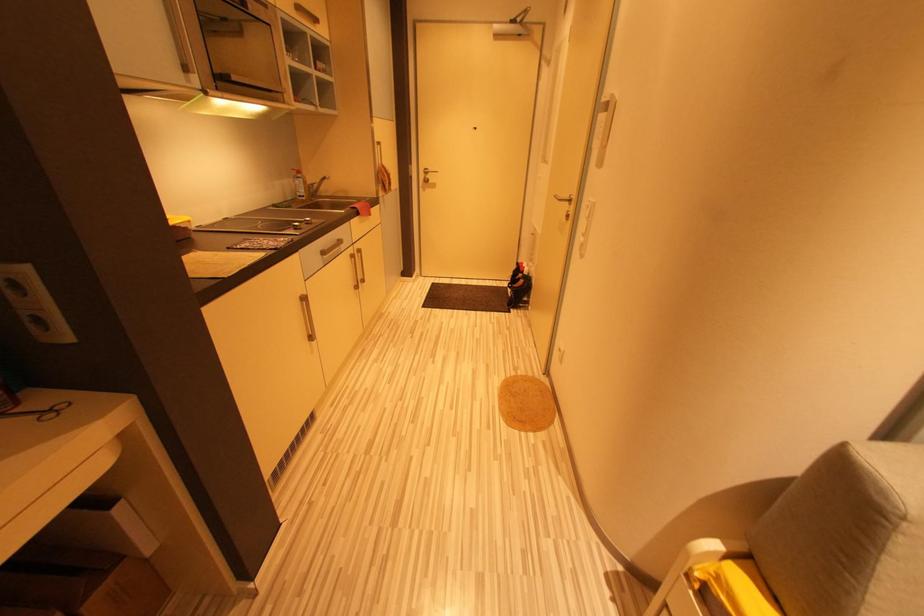
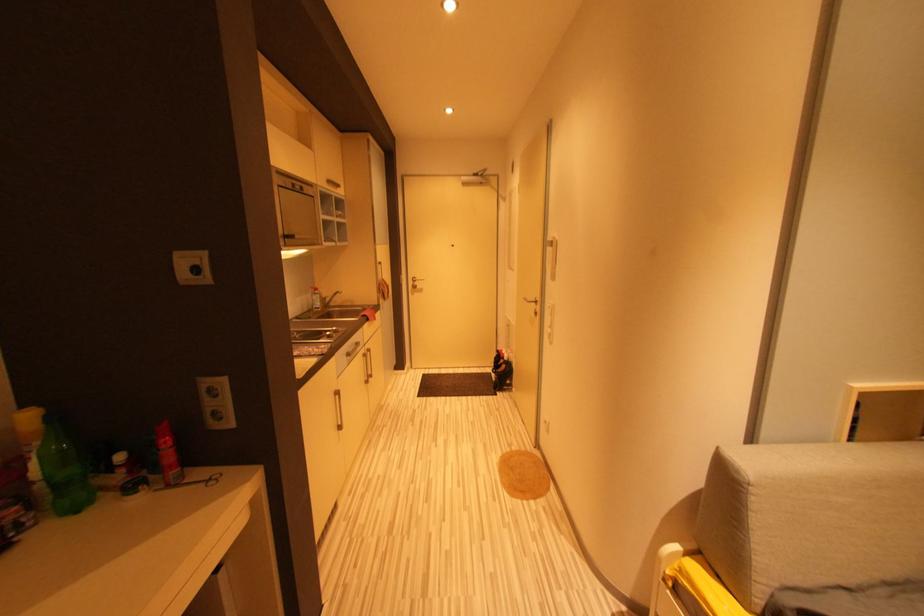
What movement of the cameraman would produce the second image?

The cameraman walked toward left, backward.